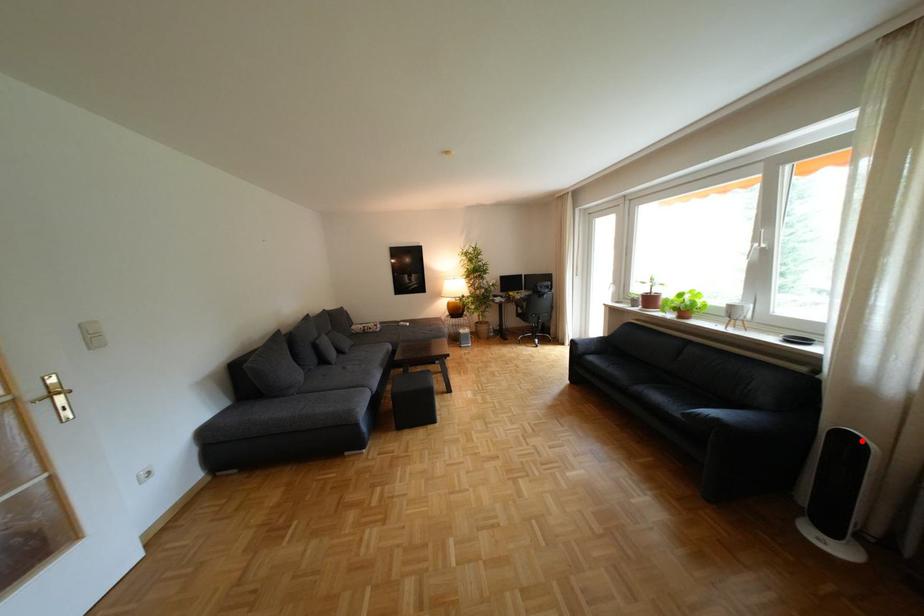
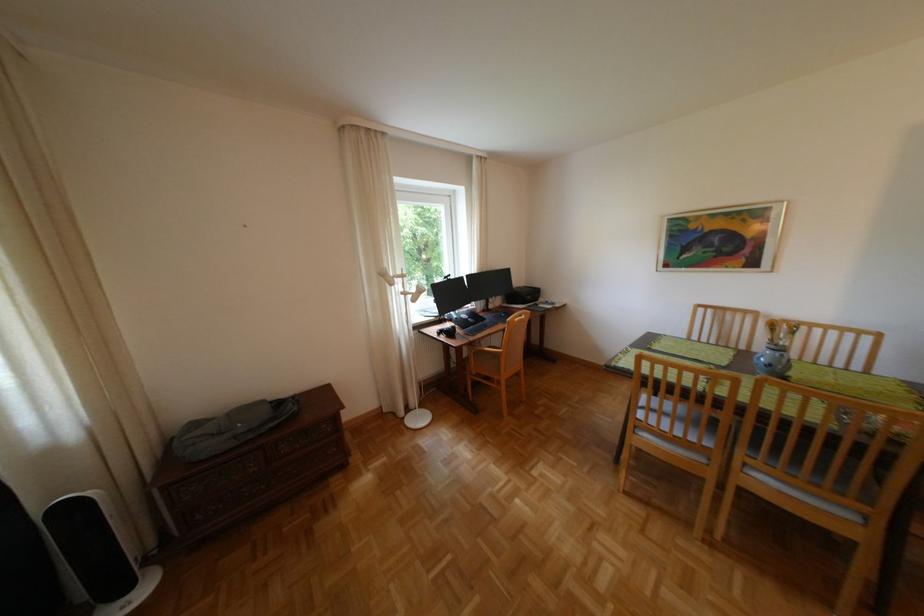
Question: I am providing you with two images of the same scene from different viewpoints. A red point is shown in image1. For the corresponding object point in image2, is it positioned nearer or farther from the camera?

Choices:
 (A) Nearer
 (B) Farther

Answer: (A)